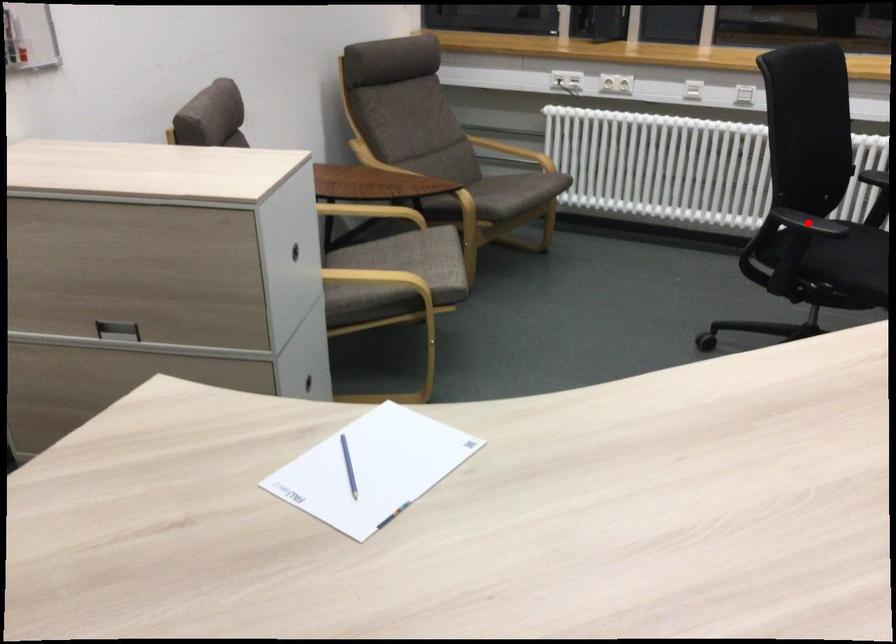
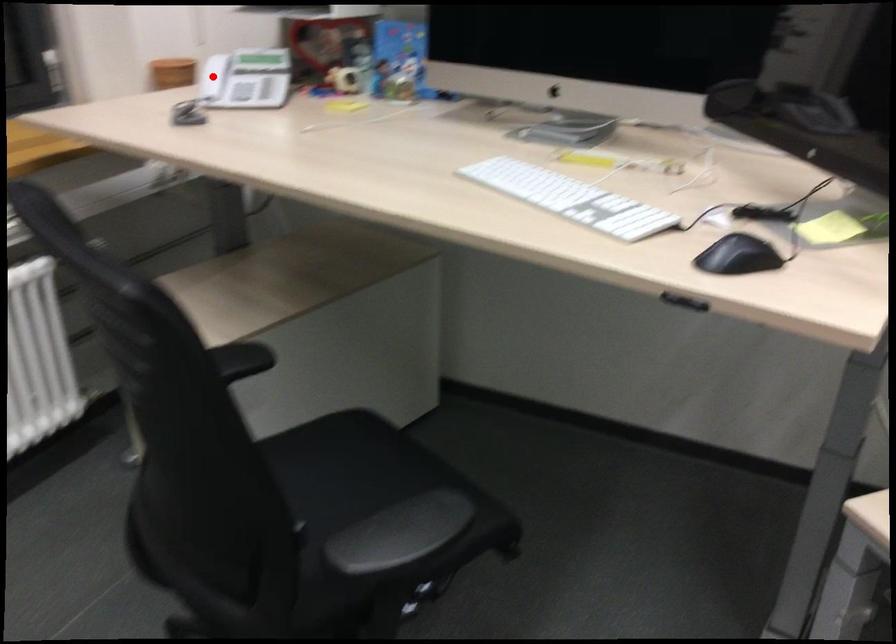
From the picture: I am providing you with two images of the same scene from different viewpoints. A red point is marked on the first image and another point is marked on the second image. Is the marked point in image1 the same physical position as the marked point in image2?

No